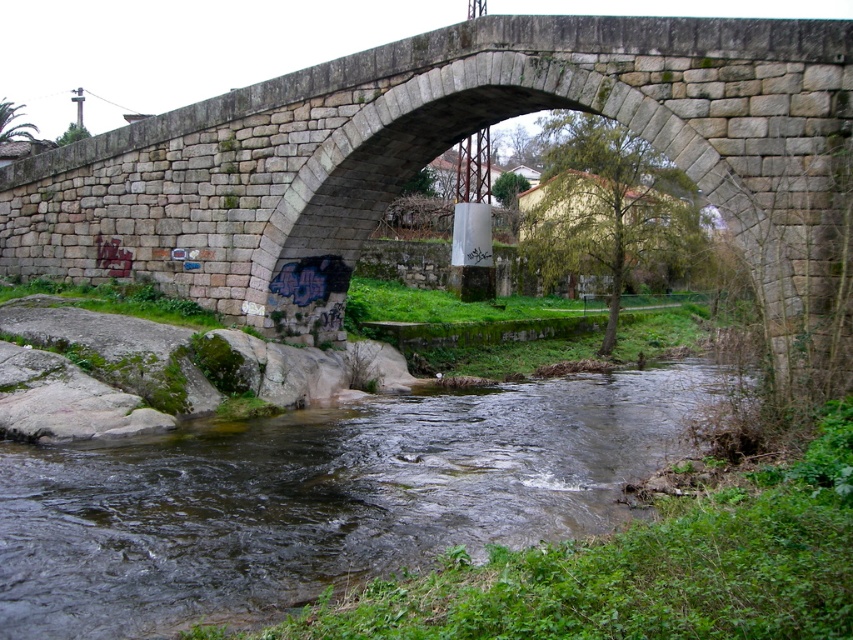
Can you confirm if gray stone bridge at center is positioned below clear water at center?

Incorrect, gray stone bridge at center is not positioned below clear water at center.

Between gray stone bridge at center and clear water at center, which one appears on the left side from the viewer's perspective?

gray stone bridge at center

Measure the distance between gray stone bridge at center and camera.

gray stone bridge at center is 78.13 feet away from camera.

The height and width of the screenshot is (640, 853). I want to click on gray stone bridge at center, so click(x=451, y=144).